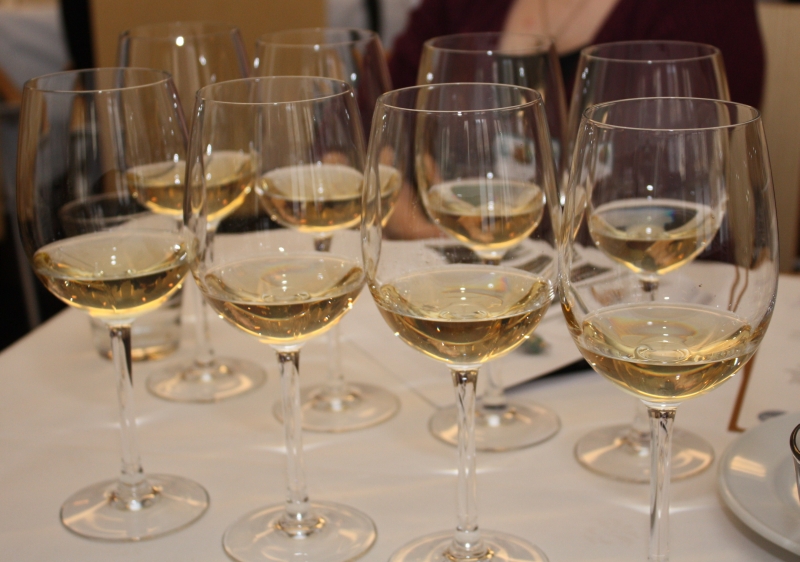
The height and width of the screenshot is (562, 800). I want to click on glasses of wine, so click(x=190, y=56), click(x=310, y=53), click(x=476, y=54), click(x=622, y=83), click(x=638, y=173), click(x=486, y=194), click(x=332, y=203), click(x=136, y=207).